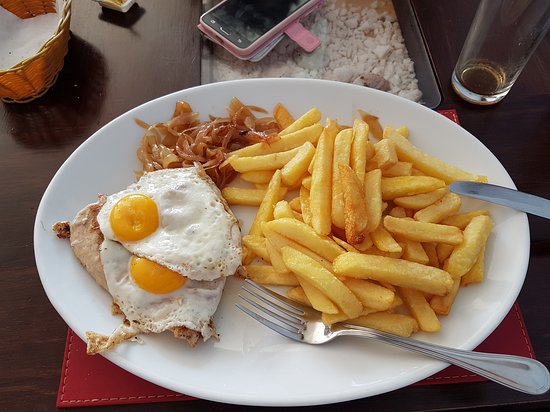
Where is `empty glass`? The width and height of the screenshot is (550, 412). empty glass is located at coordinates (500, 46).